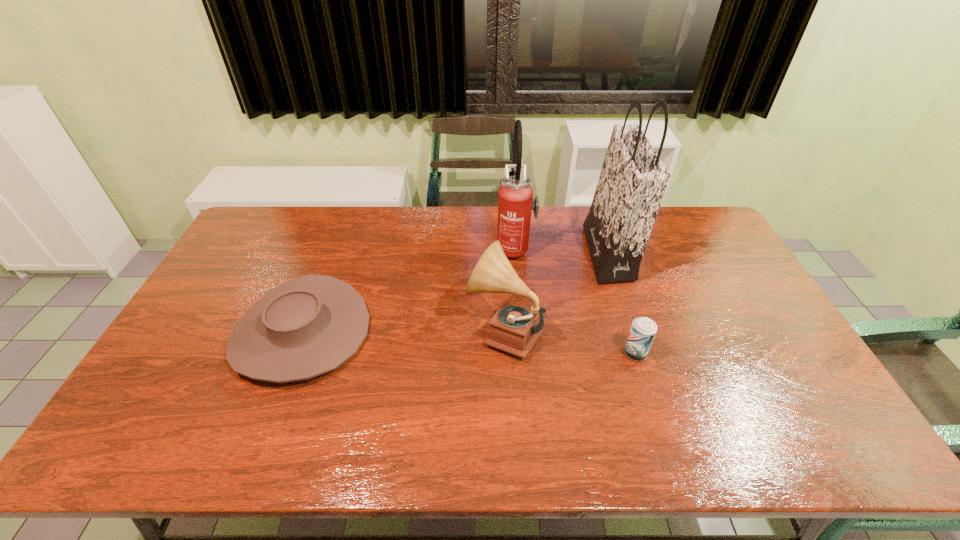
At what (x,y) coordinates should I click in order to perform the action: click on vacant space at the far edge of the desktop. Please return your answer as a coordinate pair (x, y). Looking at the image, I should click on (437, 228).

At what (x,y) coordinates should I click in order to perform the action: click on blank area at the near edge. Please return your answer as a coordinate pair (x, y). The width and height of the screenshot is (960, 540). Looking at the image, I should click on (481, 434).

You are a GUI agent. You are given a task and a screenshot of the screen. Output one action in this format:
    pyautogui.click(x=<x>, y=<y>)
    Task: Click on the free space at the left edge
    The height and width of the screenshot is (540, 960).
    Given the screenshot: What is the action you would take?
    pyautogui.click(x=199, y=391)

Identify the location of free location at the right edge. This screenshot has width=960, height=540. (789, 374).

Find the location of `vacant space at the far right corner of the desktop`. vacant space at the far right corner of the desktop is located at coordinates (685, 244).

The height and width of the screenshot is (540, 960). Find the location of `free space between the leftmost object and the fourth shortest object`. free space between the leftmost object and the fourth shortest object is located at coordinates (408, 291).

This screenshot has height=540, width=960. Identify the location of vacant point located between the shortest object and the shopping bag. (454, 293).

Where is `vacant point located between the cowboy hat and the shopping bag`? This screenshot has height=540, width=960. vacant point located between the cowboy hat and the shopping bag is located at coordinates (454, 293).

At what (x,y) coordinates should I click in order to perform the action: click on free point between the fourth tallest object and the fourth shortest object. Please return your answer as a coordinate pair (x, y). This screenshot has height=540, width=960. Looking at the image, I should click on (575, 301).

Identify the location of unoccupied area between the second tallest object and the leftmost object. This screenshot has height=540, width=960. (408, 291).